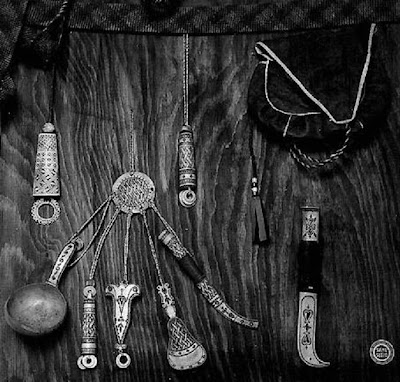
Where is `spoon`? spoon is located at coordinates (44, 306).